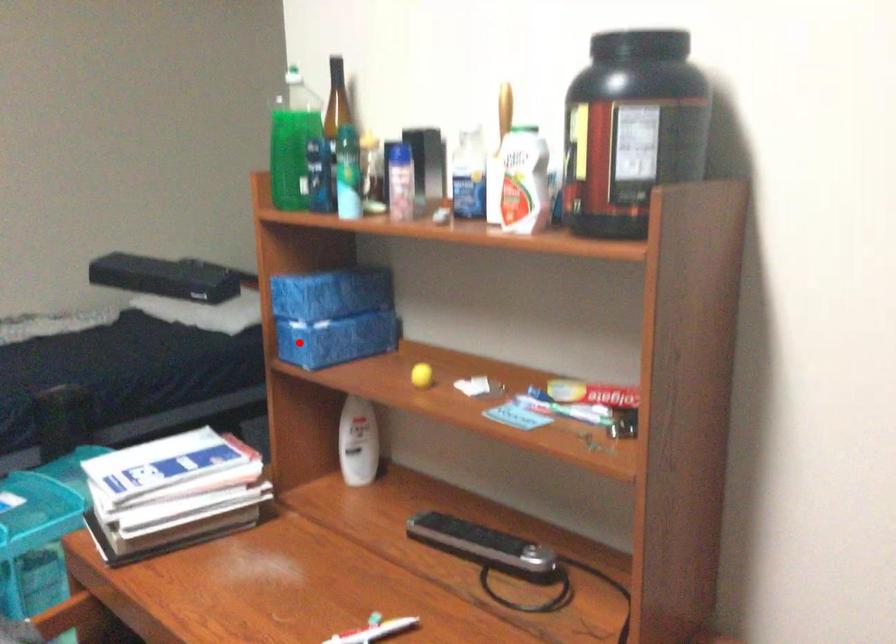
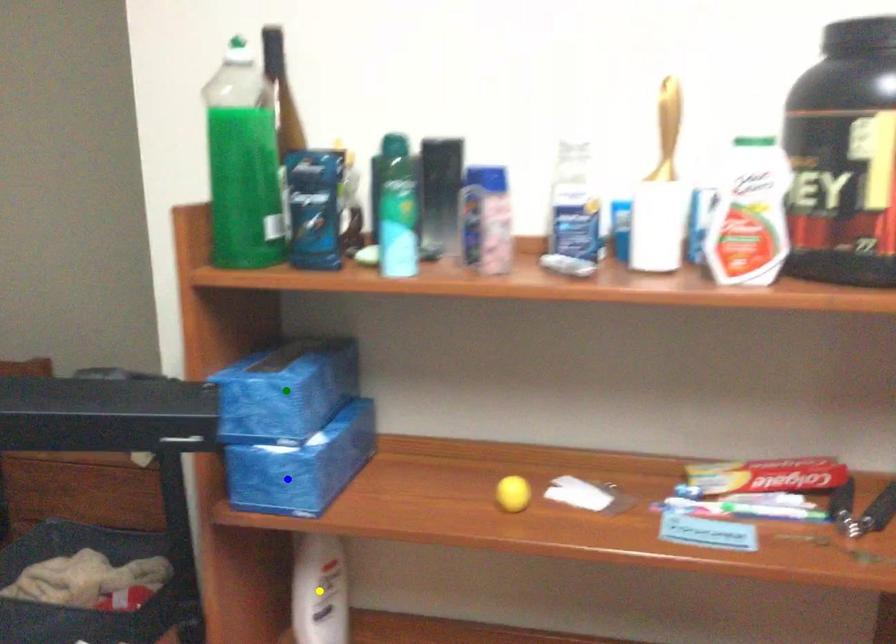
Question: I am providing you with two images of the same scene from different viewpoints. A red point is marked on the first image. You are given multiple points on the second image. Which point in image 2 is actually the same real-world point as the red point in image 1?

Choices:
 (A) blue point
 (B) green point
 (C) yellow point

Answer: (A)